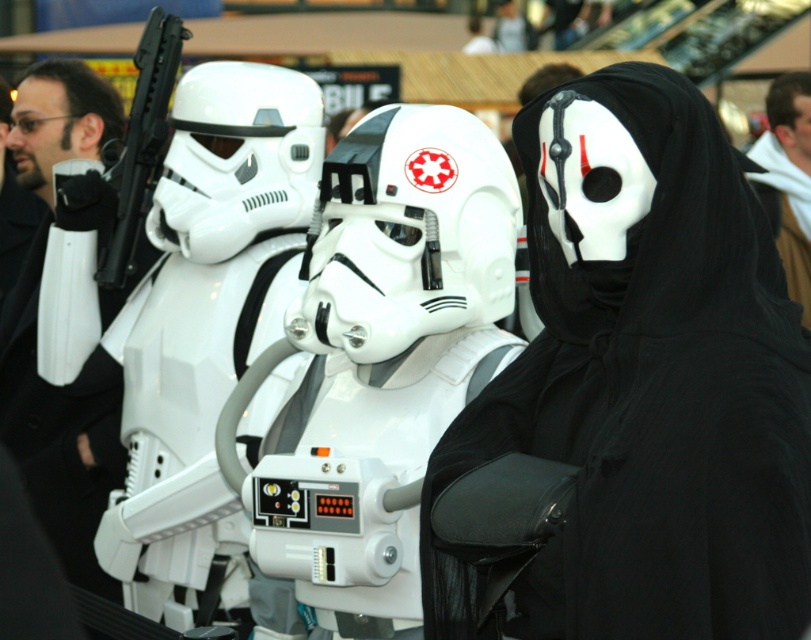
You are a photographer setting up a shoot with two props from the scene. You have the black matte mask at center and the matte black coat at left. You want to arrange them so that the mask is closer to the camera than the coat. Is the current arrangement already meeting this requirement?

Yes, the current arrangement already meets the requirement because the black matte mask at center is in front of the matte black coat at left, meaning it is closer to the camera.

You are a costume designer trying to decide which accessory to place on a mannequin. You have the black matte mask at center and the black fabric scarf at upper right. If you want to choose the wider accessory, which one should you pick?

The black matte mask at center is wider than the black fabric scarf at upper right, so you should pick the black matte mask at center.